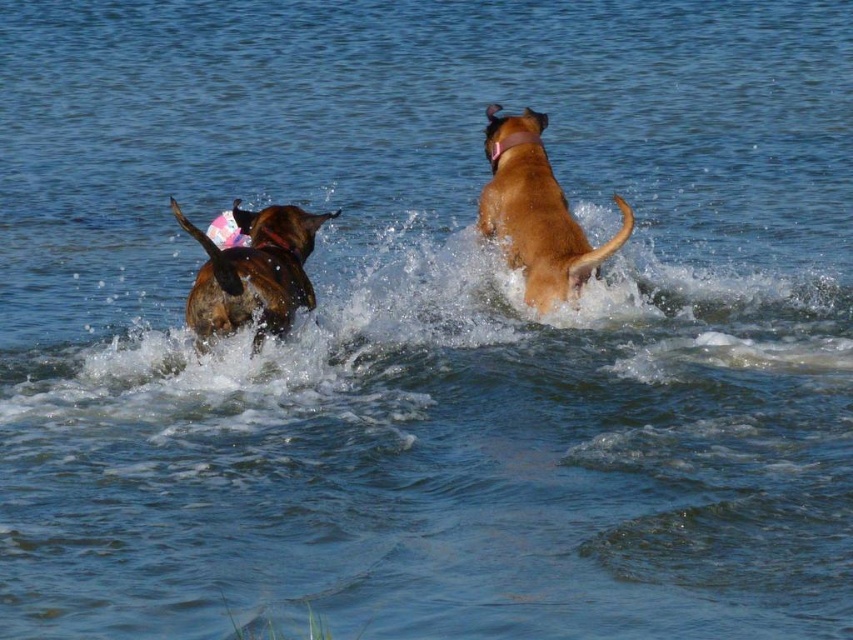
Is brown matte dog at upper right closer to camera compared to brown matte dog at left?

No.

The width and height of the screenshot is (853, 640). Find the location of `brown matte dog at upper right`. brown matte dog at upper right is located at coordinates [x=537, y=212].